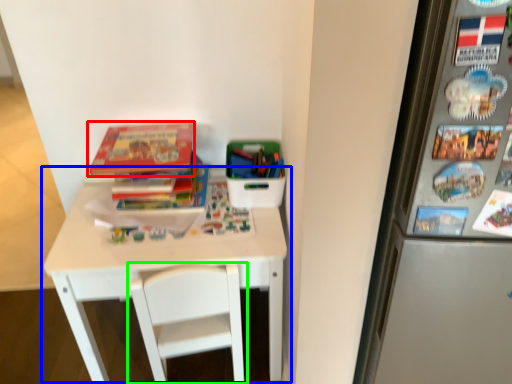
Question: Considering the real-world distances, which object is farthest from book (highlighted by a red box)? table (highlighted by a blue box) or chair (highlighted by a green box)?

Choices:
 (A) table
 (B) chair

Answer: (B)